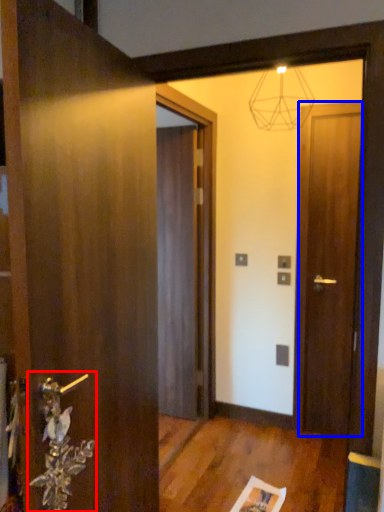
Question: Which of the following is the farthest to the observer, door handle (highlighted by a red box) or door (highlighted by a blue box)?

Choices:
 (A) door handle
 (B) door

Answer: (B)